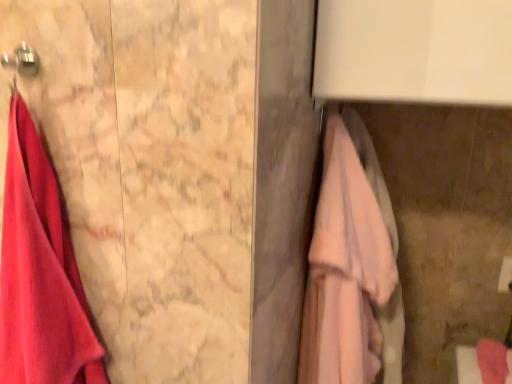
Question: Is metallic hook at upper left inside or outside of pink fabric towel bar at right?

Choices:
 (A) inside
 (B) outside

Answer: (B)

Question: Looking at their shapes, would you say metallic hook at upper left is wider or thinner than pink fabric towel bar at right?

Choices:
 (A) wide
 (B) thin

Answer: (A)

Question: Which of these objects is positioned farthest from the metallic hook at upper left?

Choices:
 (A) pink fabric towel at right, the second towel viewed from the left
 (B) matte pink towel at left, the first towel viewed from the left
 (C) pink fabric towel bar at right

Answer: (C)

Question: Estimate the real-world distances between objects in this image. Which object is closer to the metallic hook at upper left?

Choices:
 (A) matte pink towel at left, the first towel viewed from the left
 (B) pink fabric towel at right, the second towel viewed from the left
 (C) pink fabric towel bar at right

Answer: (A)